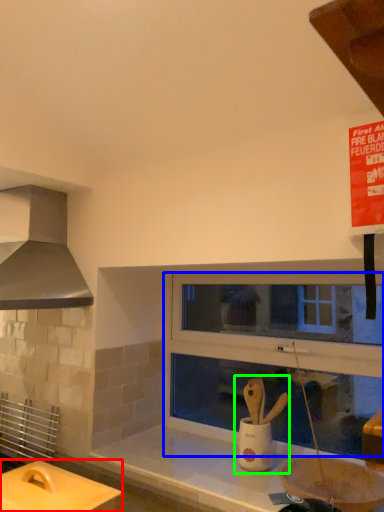
Question: Which object is the farthest from table (highlighted by a red box)? Choose among these: window frame (highlighted by a blue box) or sink (highlighted by a green box).

Choices:
 (A) window frame
 (B) sink

Answer: (A)